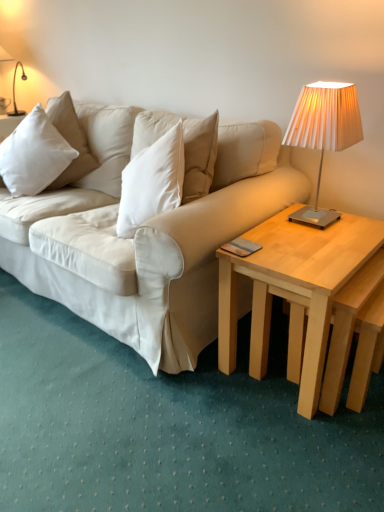
Where is `vacant space in front of light wood/natural wood coffee table at right`? The height and width of the screenshot is (512, 384). vacant space in front of light wood/natural wood coffee table at right is located at coordinates pyautogui.click(x=293, y=451).